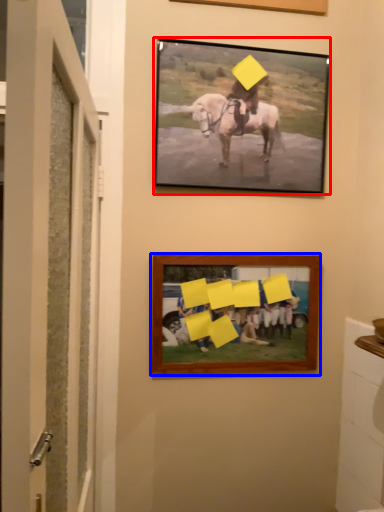
Question: Which object appears closest to the camera in this image, picture frame (highlighted by a red box) or picture frame (highlighted by a blue box)?

Choices:
 (A) picture frame
 (B) picture frame

Answer: (A)